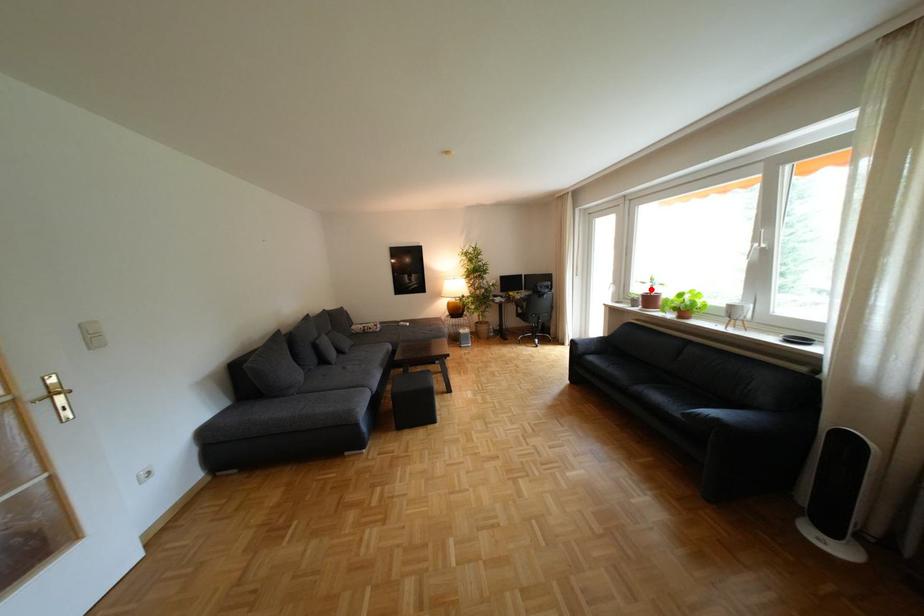
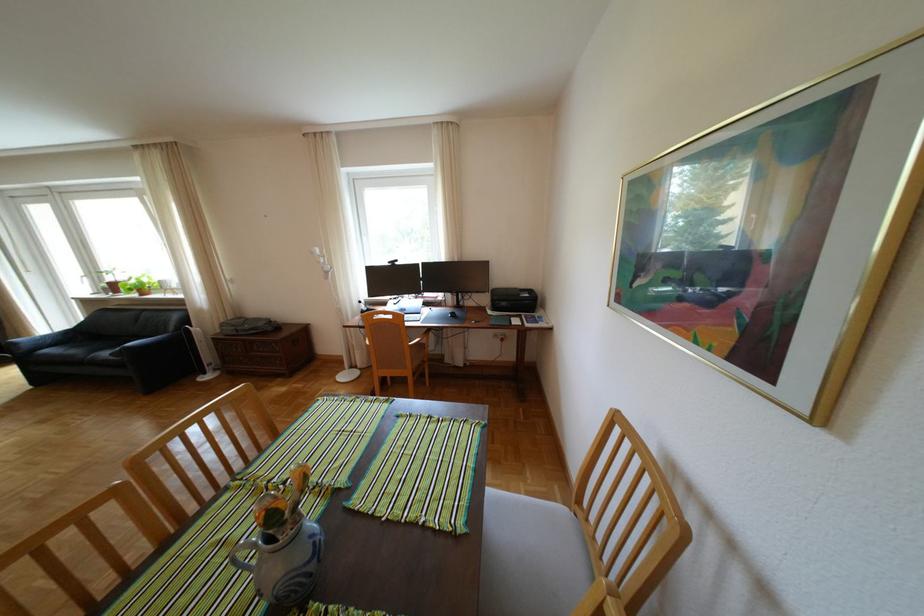
The point at the highlighted location is marked in the first image. Where is the corresponding point in the second image?

(123, 278)